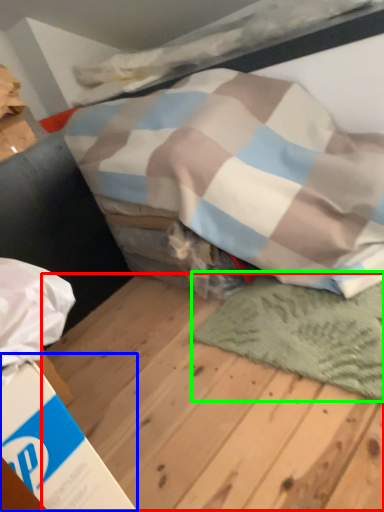
Question: Estimate the real-world distances between objects in this image. Which object is closer to plywood (highlighted by a red box), cardboard box (highlighted by a blue box) or mat (highlighted by a green box)?

Choices:
 (A) cardboard box
 (B) mat

Answer: (B)